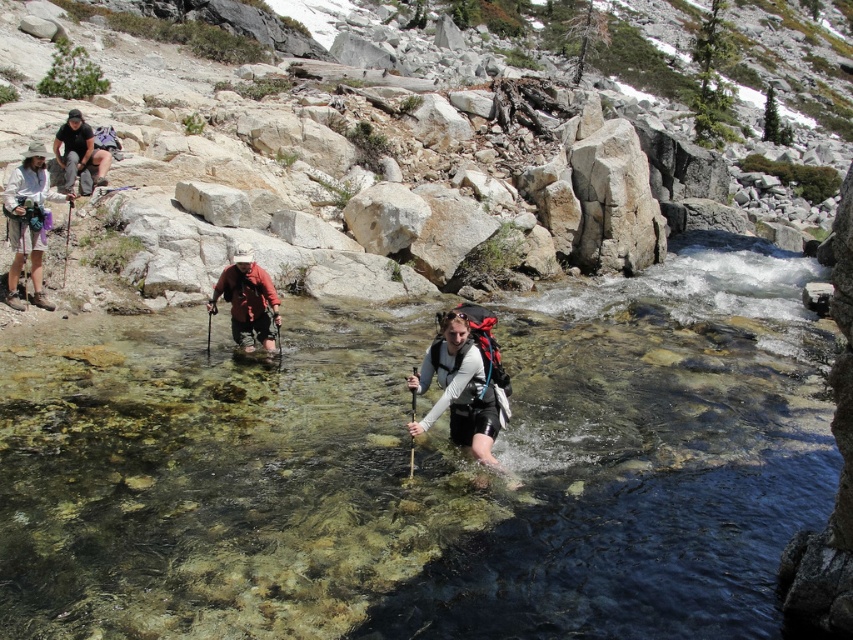
How far apart are matte black backpack at center and matte white hat at upper left?

A distance of 8.39 meters exists between matte black backpack at center and matte white hat at upper left.

Between matte black backpack at center and matte white hat at upper left, which one is positioned higher?

Positioned higher is matte white hat at upper left.

In order to click on matte black backpack at center in this screenshot , I will do `click(460, 387)`.

The image size is (853, 640). In order to click on matte black backpack at center in this screenshot , I will do `click(460, 387)`.

Is point (204, 474) farther from viewer compared to point (41, 228)?

No, (204, 474) is closer to viewer.

Where is `clear glass river at center`? This screenshot has height=640, width=853. clear glass river at center is located at coordinates (425, 468).

Who is positioned more to the right, clear glass river at center or matte black backpack at center?

clear glass river at center is more to the right.

You are a GUI agent. You are given a task and a screenshot of the screen. Output one action in this format:
    pyautogui.click(x=<x>, y=<y>)
    Task: Click on the clear glass river at center
    
    Given the screenshot: What is the action you would take?
    pyautogui.click(x=425, y=468)